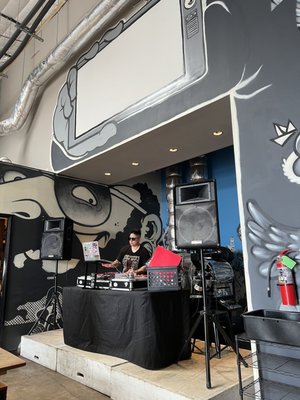
I want to click on speakers, so click(x=66, y=252), click(x=206, y=215).